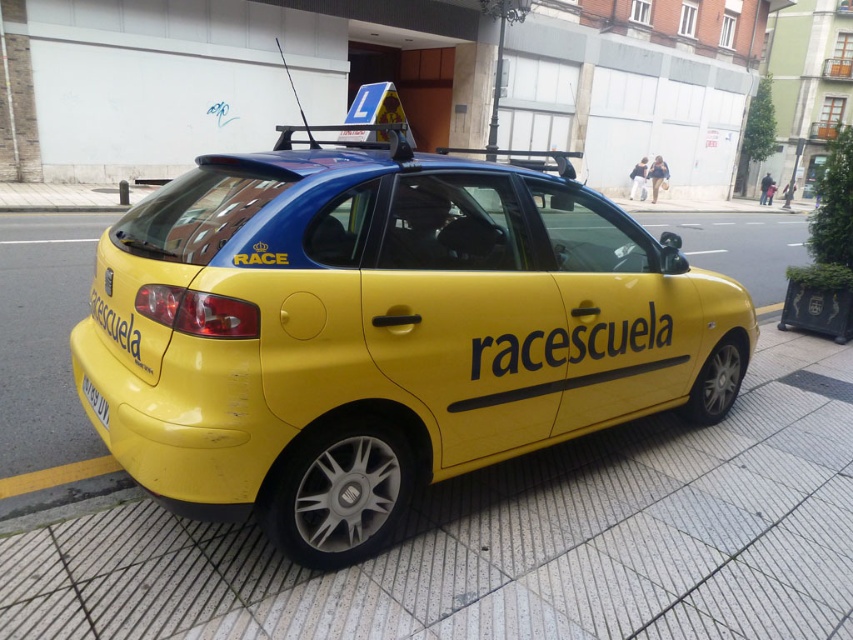
Question: Does yellow concrete pavement at lower right have a larger size compared to yellow matte text at rear?

Choices:
 (A) no
 (B) yes

Answer: (B)

Question: Which point is farther to the camera?

Choices:
 (A) yellow plastic license plate at lower left
 (B) yellow matte car at center
 (C) yellow matte text at rear
 (D) yellow matte text at center

Answer: (D)

Question: Considering the relative positions of yellow matte text at center and yellow plastic license plate at lower left in the image provided, where is yellow matte text at center located with respect to yellow plastic license plate at lower left?

Choices:
 (A) left
 (B) right

Answer: (B)

Question: Which object is farther from the camera taking this photo?

Choices:
 (A) yellow matte car at center
 (B) yellow matte text at center
 (C) yellow concrete pavement at lower right

Answer: (B)

Question: Can you confirm if yellow matte car at center is bigger than yellow matte text at center?

Choices:
 (A) no
 (B) yes

Answer: (A)

Question: Which object is the farthest from the yellow matte car at center?

Choices:
 (A) yellow matte text at rear
 (B) yellow plastic license plate at lower left

Answer: (B)